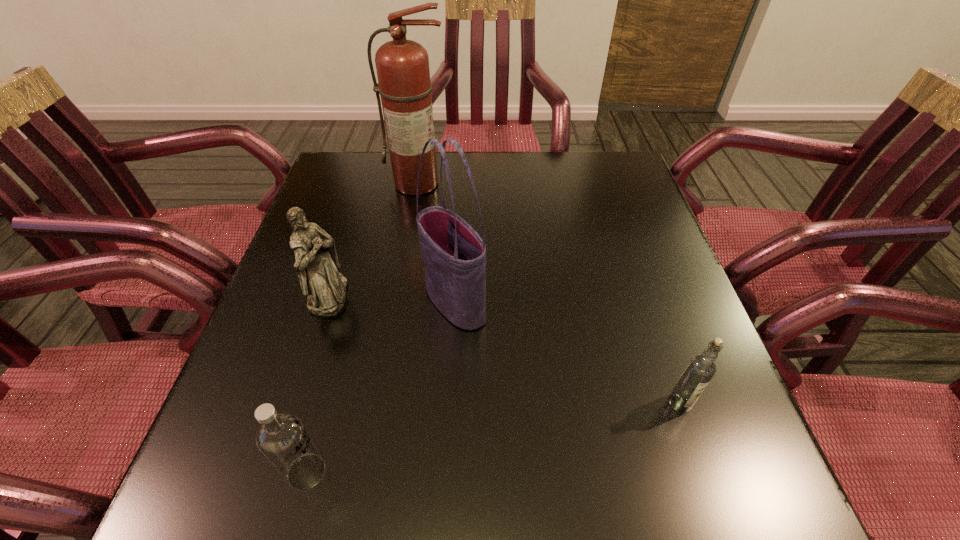
Where is `vacant space that satisfies the following two spatial constraints: 1. on the front-facing side of the fire extinguisher; 2. on the front label of the left vodka`? vacant space that satisfies the following two spatial constraints: 1. on the front-facing side of the fire extinguisher; 2. on the front label of the left vodka is located at coordinates (369, 472).

In order to click on vacant region that satisfies the following two spatial constraints: 1. on the back side of the tote bag; 2. on the front-facing side of the figurine in this screenshot , I will do `click(455, 295)`.